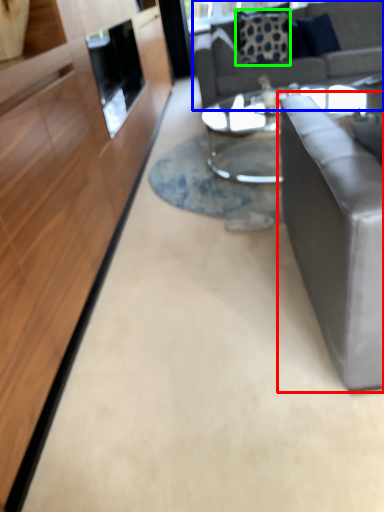
Question: Which object is positioned closest to studio couch (highlighted by a red box)? Select from studio couch (highlighted by a blue box) and pillow (highlighted by a green box).

Choices:
 (A) studio couch
 (B) pillow

Answer: (A)